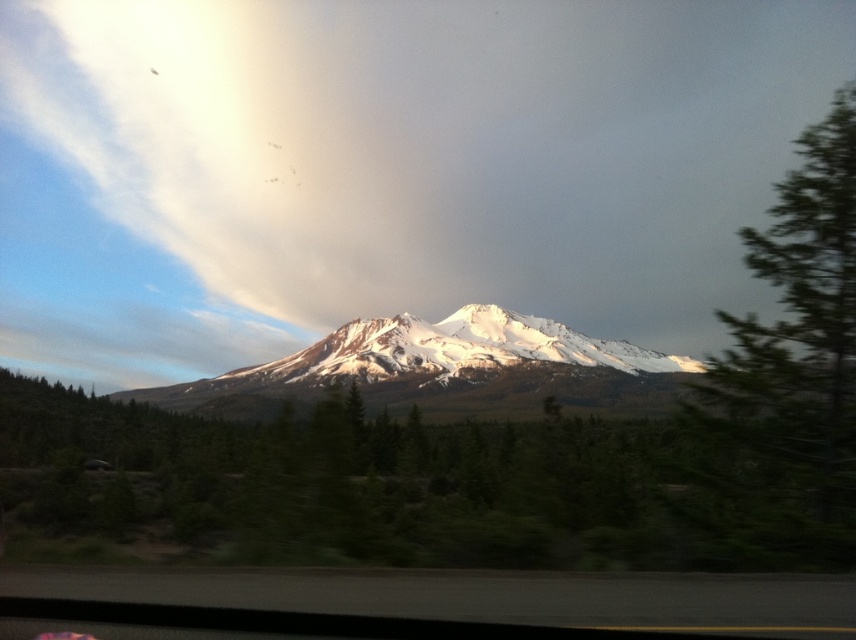
You are driving along a mountain road and notice a green textured tree at right and a snowy white mountain at center in the distance. Which object is nearer to your car?

The green textured tree at right is closer to the viewer than the snowy white mountain at center.

You are a photographer standing at the camera position, and you want to capture a closeup shot of the green textured tree at right. Given that your telephoto lens can focus on objects up to 50 feet away, will you be able to take the closeup without moving closer?

The green textured tree at right is 63.74 feet from the camera, which is beyond the telephoto lens maximum focus distance of 50 feet. Therefore, you cannot take the closeup without moving closer.